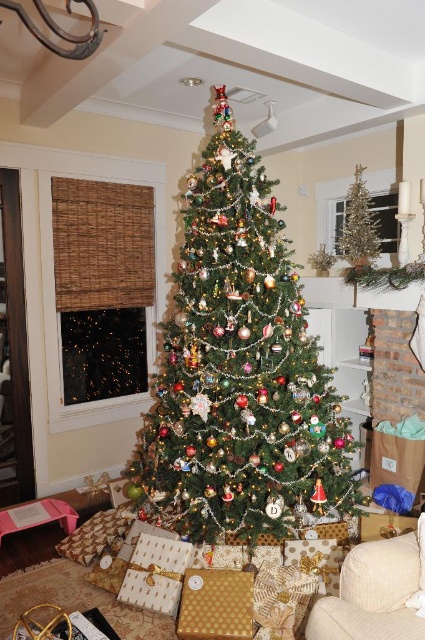
Question: Can you confirm if green matte christmas tree at center is thinner than gold textured gift at lower center?

Choices:
 (A) no
 (B) yes

Answer: (A)

Question: Based on their relative distances, which object is nearer to the beige fabric armchair at lower right?

Choices:
 (A) gold textured gift at lower center
 (B) green matte christmas tree at center
 (C) gold textured tree at center

Answer: (A)

Question: Can you confirm if green matte christmas tree at center is smaller than gold textured tree at center?

Choices:
 (A) no
 (B) yes

Answer: (A)

Question: Which point is closer to the camera?

Choices:
 (A) (280, 371)
 (B) (407, 620)
 (C) (232, 573)

Answer: (B)

Question: Among these objects, which one is nearest to the camera?

Choices:
 (A) green matte christmas tree at center
 (B) gold textured tree at center

Answer: (A)

Question: Can you confirm if beige fabric armchair at lower right is thinner than gold textured gift at lower center?

Choices:
 (A) yes
 (B) no

Answer: (B)